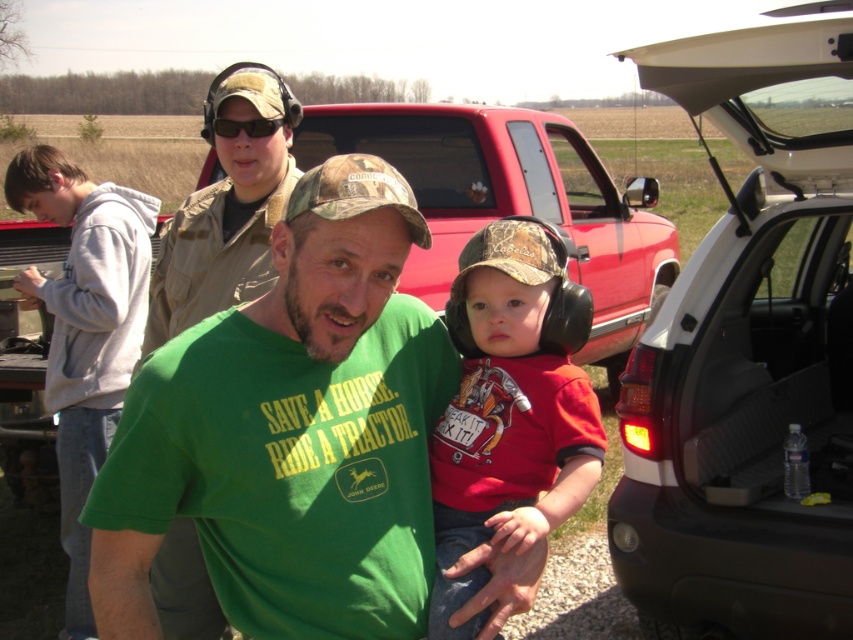
In the scene shown: You are a child playing with toy vehicles in the image. You want to place both the black plastic car at right and the black plastic suv at right into a narrow toy garage. Which vehicle will fit better through the entrance?

The black plastic car at right is thinner than the black plastic suv at right, so it will fit better through the narrow entrance of the toy garage.

You are standing at the point with coordinates point (764, 124) and want to walk to the point with coordinates point (316, 124). Which direction should you move in?

You should move backward because point (764, 124) is in front of point (316, 124).